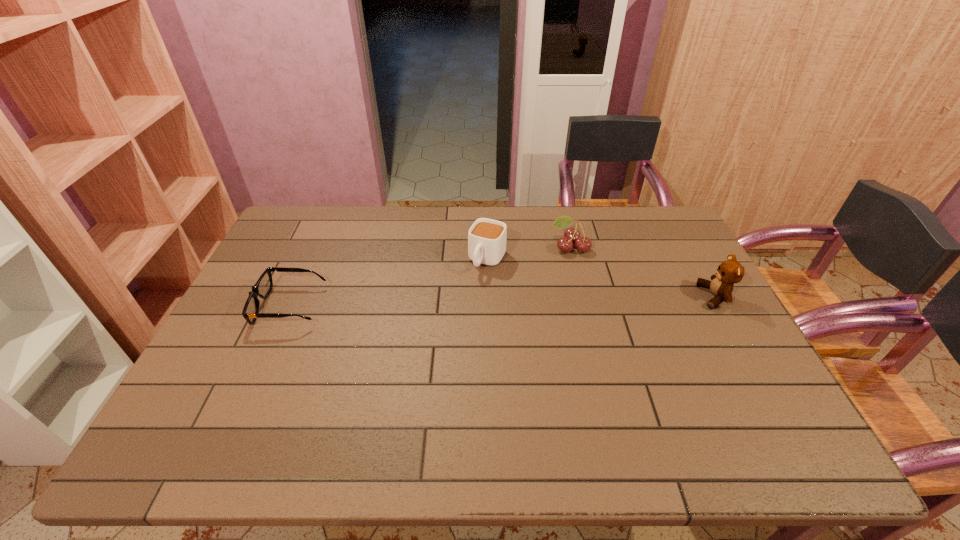
Find the location of a particular element. free spot on the desktop that is between the leftmost object and the tallest object and is positioned on the leaves of the third object from left to right is located at coordinates (537, 300).

This screenshot has height=540, width=960. Find the location of `free spot on the desktop that is between the leftmost object and the teddy bear and is positioned on the side with the handle of the third object from right to left`. free spot on the desktop that is between the leftmost object and the teddy bear and is positioned on the side with the handle of the third object from right to left is located at coordinates (462, 302).